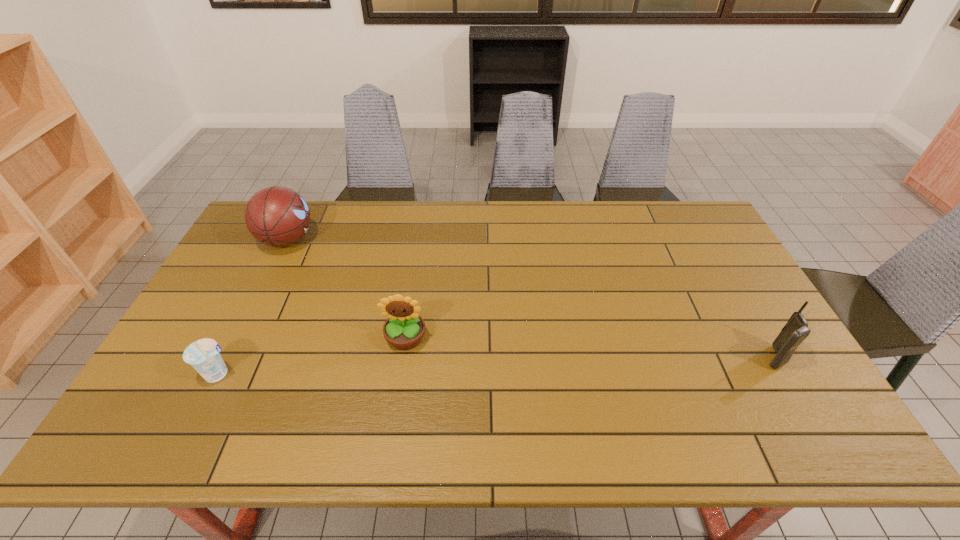
Locate which object is the closest to the basketball. Please provide its 2D coordinates. Your answer should be formatted as a tuple, i.e. [(x, y)], where the tuple contains the x and y coordinates of a point satisfying the conditions above.

[(203, 355)]